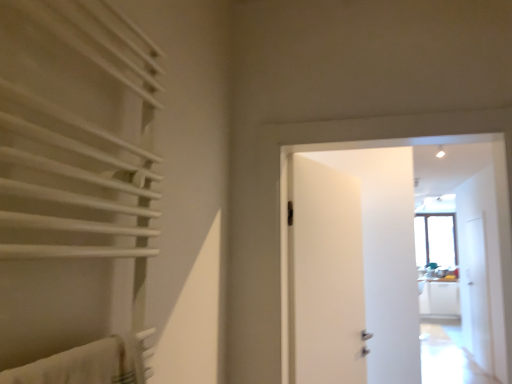
Question: Is white matte door at center inside the boundaries of white matte towel rack at left, or outside?

Choices:
 (A) outside
 (B) inside

Answer: (A)

Question: Is point (269, 188) closer or farther from the camera than point (44, 82)?

Choices:
 (A) closer
 (B) farther

Answer: (B)

Question: Which of these objects is positioned farthest from the transparent glass screen door at right?

Choices:
 (A) white matte door at center
 (B) white matte towel rack at left

Answer: (B)

Question: Which object is positioned farthest from the white matte door at center?

Choices:
 (A) white matte towel rack at left
 (B) transparent glass screen door at right

Answer: (B)